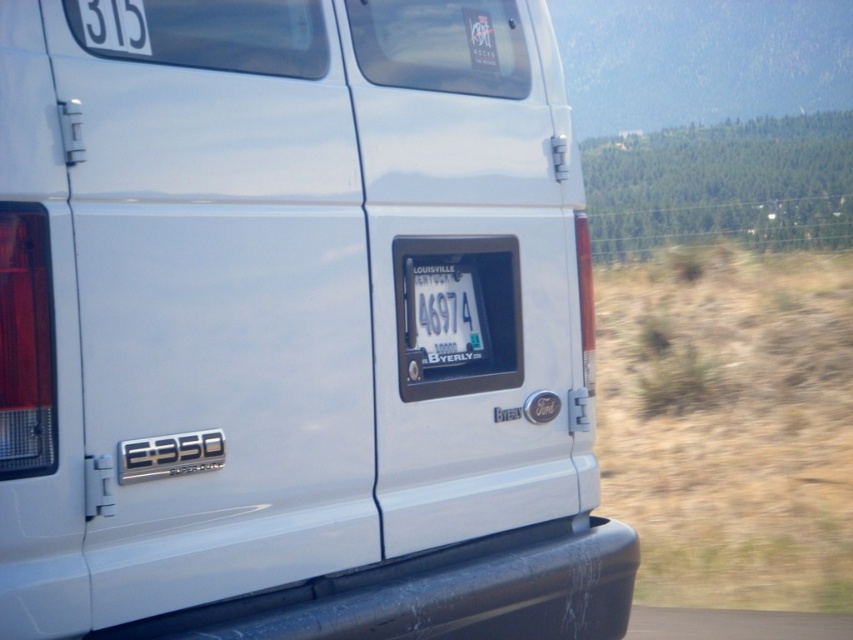
You are a delivery driver who needs to attach a heavy package to the back of your van. The package is 1.2 meters wide. The van has a black rubber bumper at lower center and a white plastic license plate at center. Which part can you safely attach the package to without covering the license plate?

The black rubber bumper at lower center is bigger than the white plastic license plate at center, so you can safely attach the package to the black rubber bumper at lower center without covering the license plate.

You are a delivery driver who needs to attach a new license plate to your van. The new plate is the same size as the current one. Where should you place it so that it is positioned below the existing white plastic license plate at center without overlapping the black rubber bumper at lower center?

Since the black rubber bumper at lower center is taller than the white plastic license plate at center, you should place the new license plate above the existing one to avoid overlapping the bumper. Alternatively, if placement below is required, ensure there is enough space between the bumper and the existing plate to accommodate the new plate without overlapping.

You are a delivery driver who needs to attach a heavy package to the van. The package must be placed below the white plastic license plate at center. Is the black rubber bumper at lower center a suitable location for this?

The black rubber bumper at lower center is located below the white plastic license plate at center, so it is a suitable location to attach the heavy package below the white plastic license plate at center.